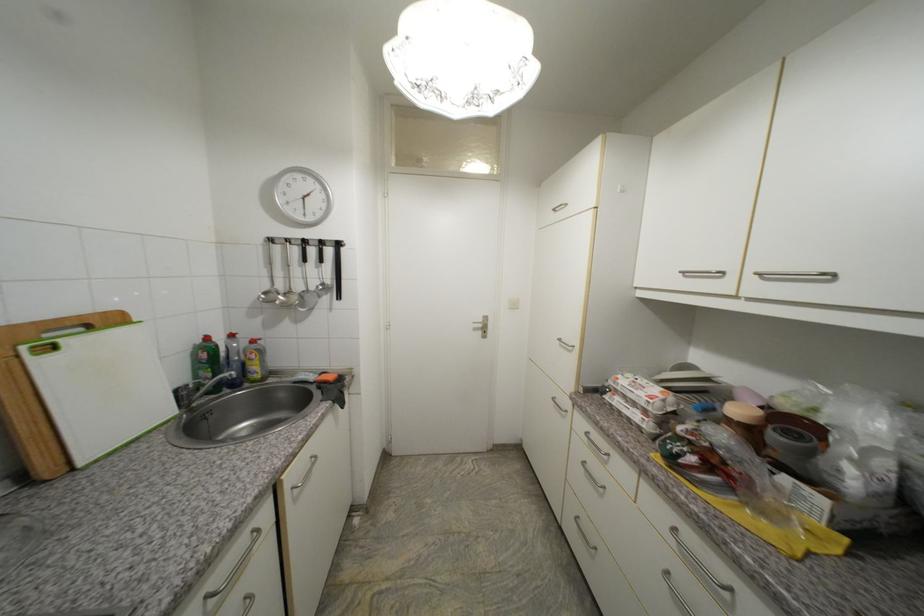
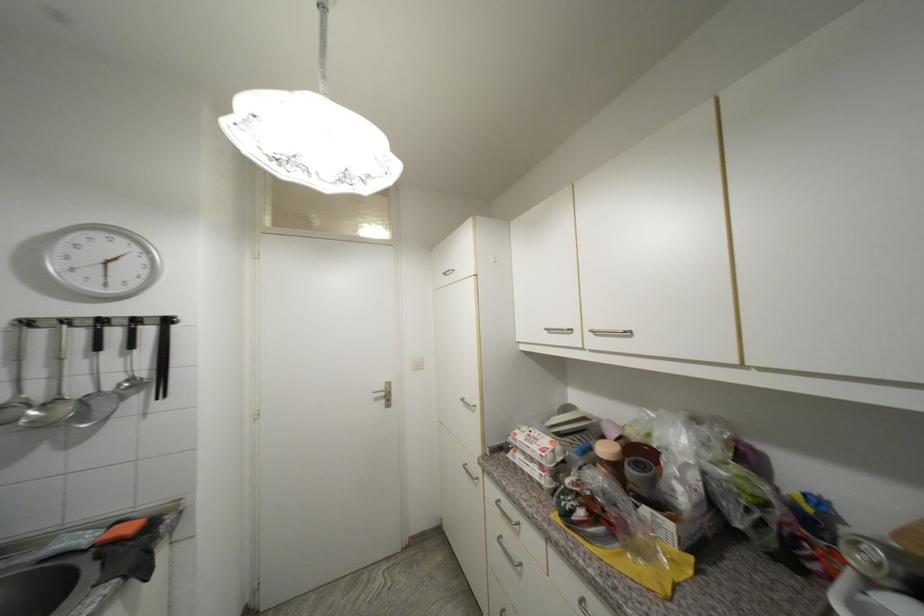
The point at (565, 341) is marked in the first image. Where is the corresponding point in the second image?

(468, 400)